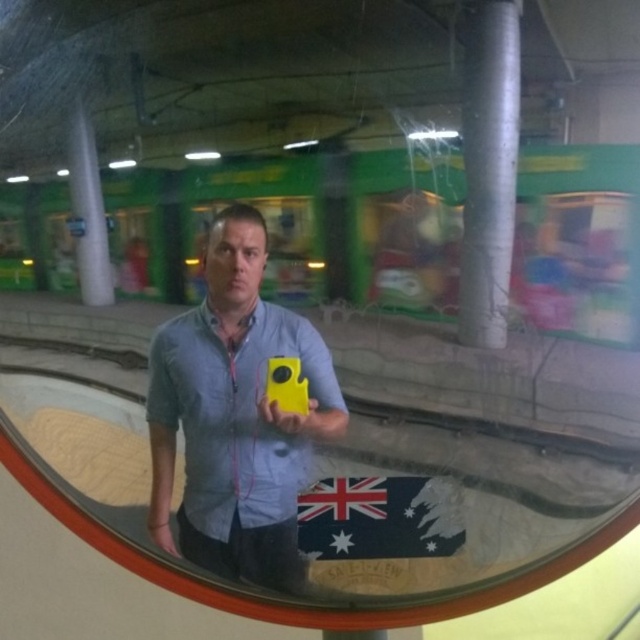
Can you confirm if matte yellow camera at center is wider than dark green fabric flag at center?

Correct, the width of matte yellow camera at center exceeds that of dark green fabric flag at center.

Which is above, matte yellow camera at center or dark green fabric flag at center?

Positioned higher is matte yellow camera at center.

Who is more forward, (x=236, y=552) or (x=372, y=518)?

Point (x=372, y=518) is in front.

This screenshot has height=640, width=640. I want to click on matte yellow camera at center, so click(x=236, y=416).